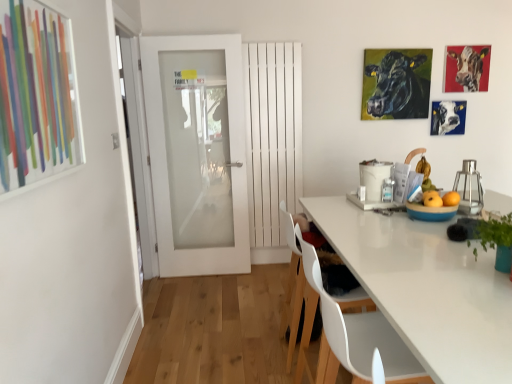
Question: Is metallic glass container at right not close to green glossy plant at right?

Choices:
 (A) yes
 (B) no

Answer: (B)

Question: From the image's perspective, is metallic glass container at right located above green glossy plant at right?

Choices:
 (A) yes
 (B) no

Answer: (A)

Question: Could you tell me if metallic glass container at right is facing green glossy plant at right?

Choices:
 (A) yes
 (B) no

Answer: (B)

Question: Is metallic glass container at right closer to the viewer compared to green glossy plant at right?

Choices:
 (A) yes
 (B) no

Answer: (B)

Question: Considering the relative sizes of metallic glass container at right and green glossy plant at right in the image provided, is metallic glass container at right bigger than green glossy plant at right?

Choices:
 (A) yes
 (B) no

Answer: (A)

Question: Is point (293, 337) positioned closer to the camera than point (331, 319)?

Choices:
 (A) farther
 (B) closer

Answer: (A)

Question: Is white plastic chair at lower center, the 1th chair positioned from the back, bigger or smaller than white plastic chair at lower center, which is the first chair from front to back?

Choices:
 (A) small
 (B) big

Answer: (B)

Question: Is white plastic chair at lower center, the 1th chair positioned from the back, to the left or to the right of white plastic chair at lower center, which is the first chair from front to back, in the image?

Choices:
 (A) right
 (B) left

Answer: (B)

Question: In the image, is white plastic chair at lower center, which is counted as the second chair, starting from the front, positioned in front of or behind white plastic chair at lower center, the second chair from the back?

Choices:
 (A) behind
 (B) front

Answer: (A)

Question: Choose the correct answer: Is metallic glass container at right inside black glossy cattle at upper right, the 3th cattle positioned from the right, or outside it?

Choices:
 (A) outside
 (B) inside

Answer: (A)

Question: From their relative heights in the image, would you say metallic glass container at right is taller or shorter than black glossy cattle at upper right, the 1th cattle from the left?

Choices:
 (A) tall
 (B) short

Answer: (B)

Question: In terms of size, does metallic glass container at right appear bigger or smaller than black glossy cattle at upper right, the 3th cattle positioned from the right?

Choices:
 (A) big
 (B) small

Answer: (B)

Question: Relative to black glossy cattle at upper right, the 3th cattle positioned from the right, is metallic glass container at right in front or behind?

Choices:
 (A) behind
 (B) front

Answer: (B)

Question: Is black glossy cattle at upper right, the 3th cattle positioned from the right, spatially inside blue glossy bowl at right, or outside of it?

Choices:
 (A) outside
 (B) inside

Answer: (A)

Question: In terms of height, does black glossy cattle at upper right, the 3th cattle positioned from the right, look taller or shorter compared to blue glossy bowl at right?

Choices:
 (A) tall
 (B) short

Answer: (A)